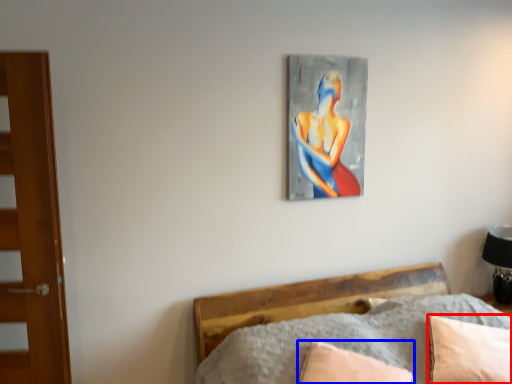
Question: Which point is closer to the camera, pillow (highlighted by a red box) or pillow (highlighted by a blue box)?

Choices:
 (A) pillow
 (B) pillow

Answer: (B)